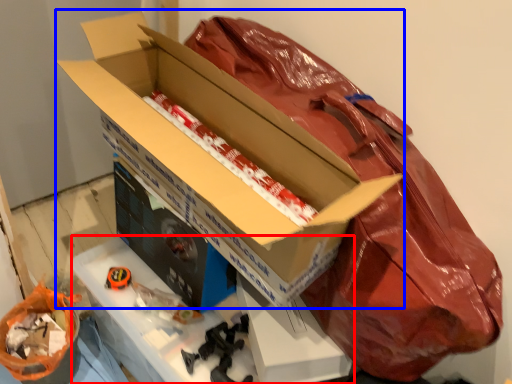
Question: Among these objects, which one is farthest to the camera, workbench (highlighted by a red box) or box (highlighted by a blue box)?

Choices:
 (A) workbench
 (B) box

Answer: (A)